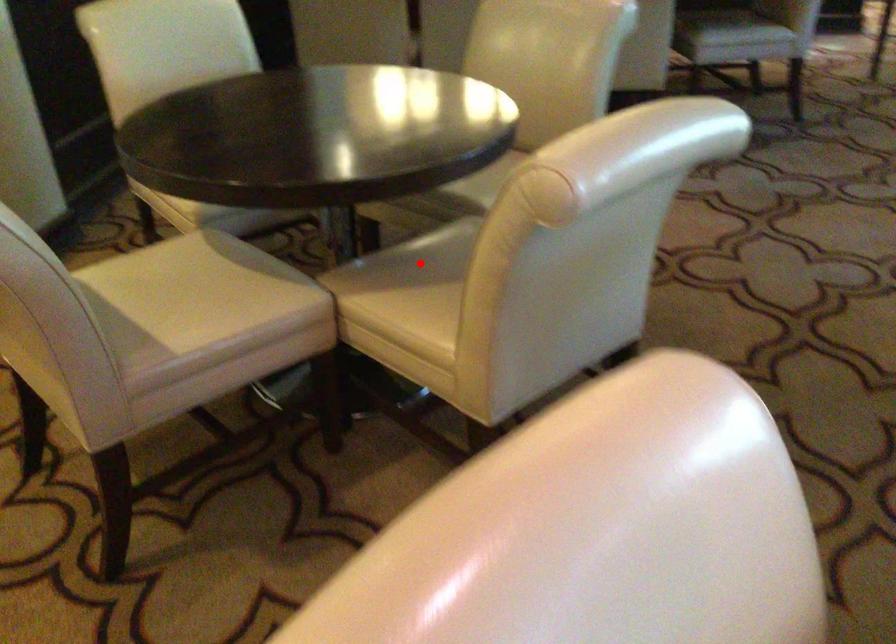
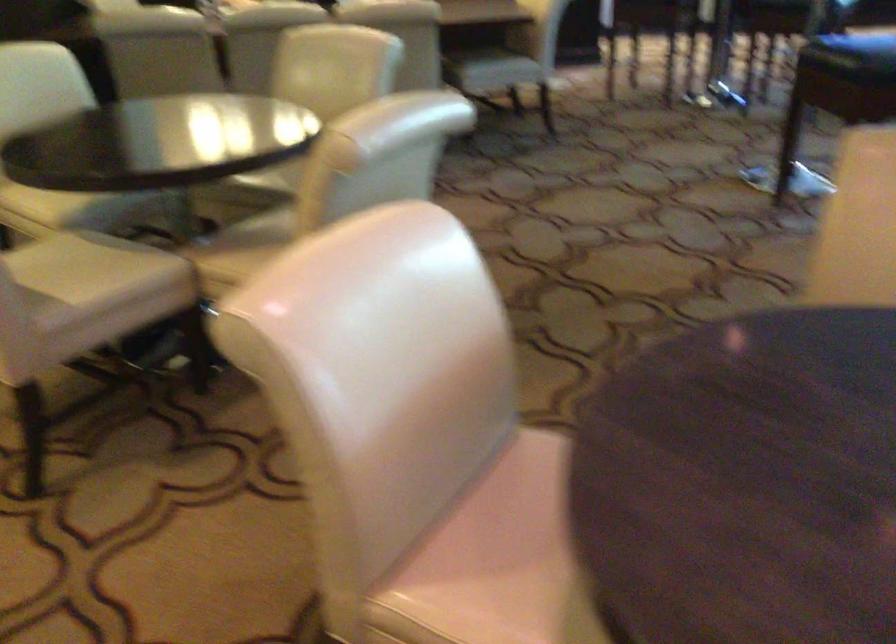
Question: I am providing you with two images of the same scene from different viewpoints. Given a red point in image1, look at the same physical point in image2. Is it:

Choices:
 (A) Closer to the viewpoint
 (B) Farther from the viewpoint

Answer: (B)